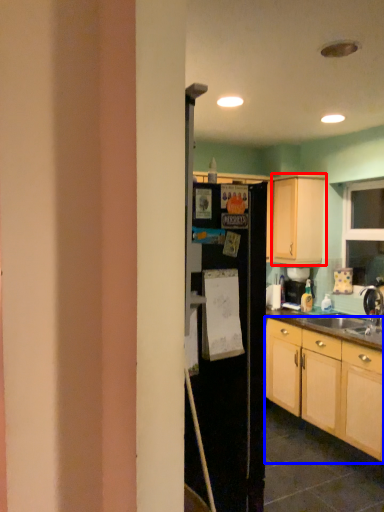
Question: Among these objects, which one is nearest to the camera, cabinetry (highlighted by a red box) or cabinetry (highlighted by a blue box)?

Choices:
 (A) cabinetry
 (B) cabinetry

Answer: (B)